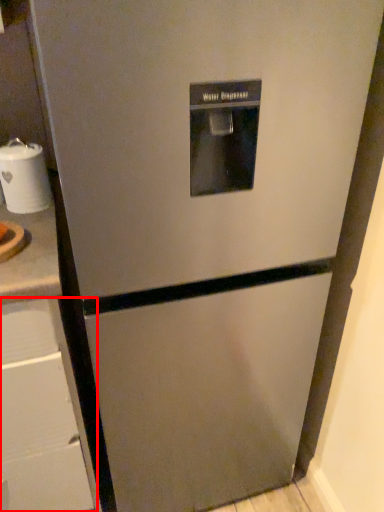
Question: From the image's perspective, what is the correct spatial positioning of drawer (annotated by the red box) in reference to appliance?

Choices:
 (A) above
 (B) below

Answer: (B)